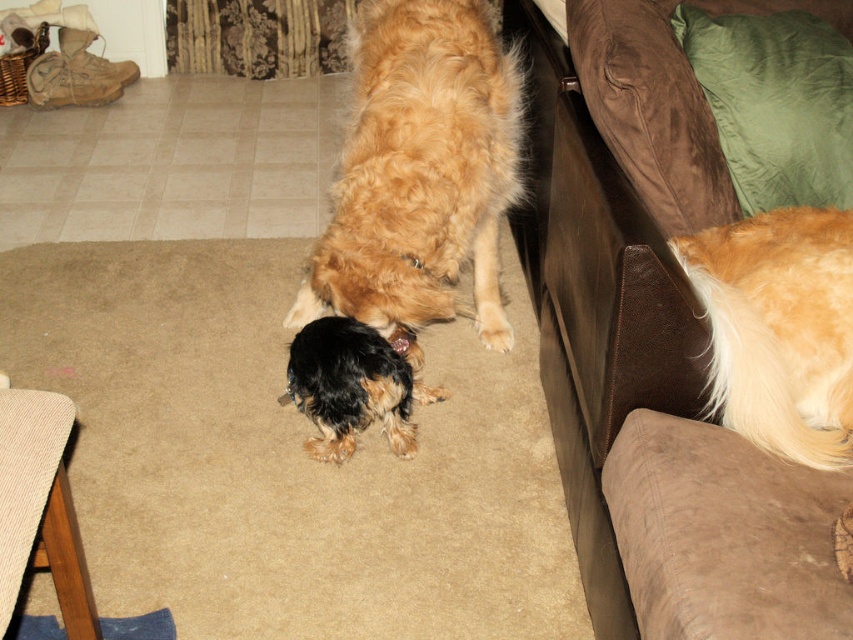
Question: Which of these objects is positioned farthest from the golden fur dog at right?

Choices:
 (A) brown suede couch at right
 (B) shiny black fur at center
 (C) golden fur dog at center

Answer: (B)

Question: Can you confirm if golden fur dog at right is smaller than shiny black fur at center?

Choices:
 (A) no
 (B) yes

Answer: (B)

Question: Which point is farther to the camera?

Choices:
 (A) (334, 451)
 (B) (769, 289)
 (C) (399, 285)

Answer: (A)

Question: Which is nearer to the brown suede couch at right?

Choices:
 (A) golden fur dog at right
 (B) shiny black fur at center
 (C) golden fur dog at center

Answer: (A)

Question: Where is brown suede couch at right located in relation to shiny black fur at center in the image?

Choices:
 (A) right
 (B) left

Answer: (A)

Question: Is brown suede couch at right below golden fur dog at center?

Choices:
 (A) yes
 (B) no

Answer: (A)